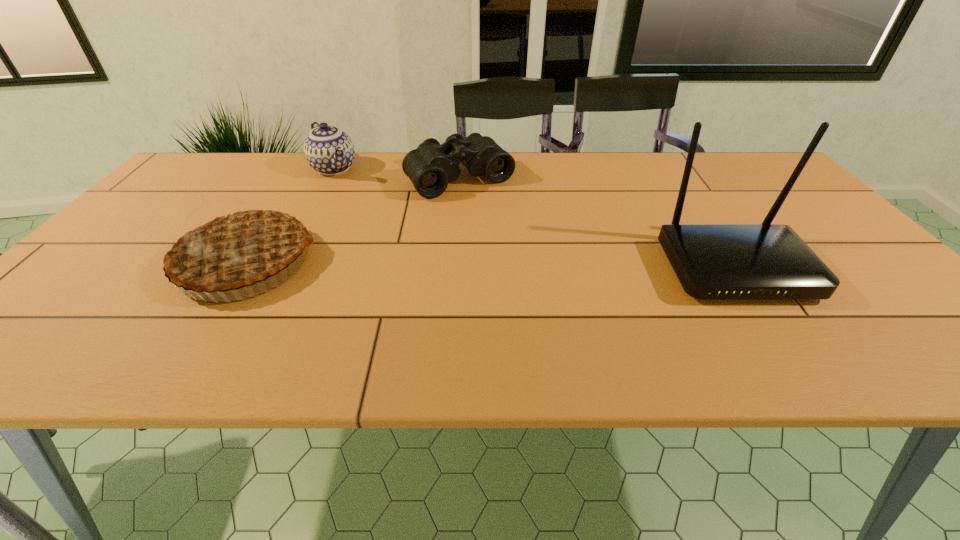
Find the location of a particular element. Image resolution: width=960 pixels, height=540 pixels. blank area located 0.260m at the eyepieces of the shortest object is located at coordinates (528, 252).

This screenshot has width=960, height=540. Identify the location of blank space located at the spout of the chinaware. (396, 239).

The height and width of the screenshot is (540, 960). I want to click on vacant area located at the spout of the chinaware, so click(357, 199).

Identify the location of vacant space positioned 0.330m at the spout of the chinaware. (392, 235).

Where is `binoculars that is at the far edge`? Image resolution: width=960 pixels, height=540 pixels. binoculars that is at the far edge is located at coordinates (430, 167).

At what (x,y) coordinates should I click in order to perform the action: click on chinaware at the far edge. Please return your answer as a coordinate pair (x, y). The height and width of the screenshot is (540, 960). Looking at the image, I should click on (328, 150).

The image size is (960, 540). I want to click on pie that is at the near edge, so click(234, 245).

Locate an element on the screen. router at the near edge is located at coordinates (766, 261).

Where is `free location at the far edge of the desktop`? Image resolution: width=960 pixels, height=540 pixels. free location at the far edge of the desktop is located at coordinates (532, 161).

Where is `free space at the near edge of the desktop`? free space at the near edge of the desktop is located at coordinates [x=487, y=312].